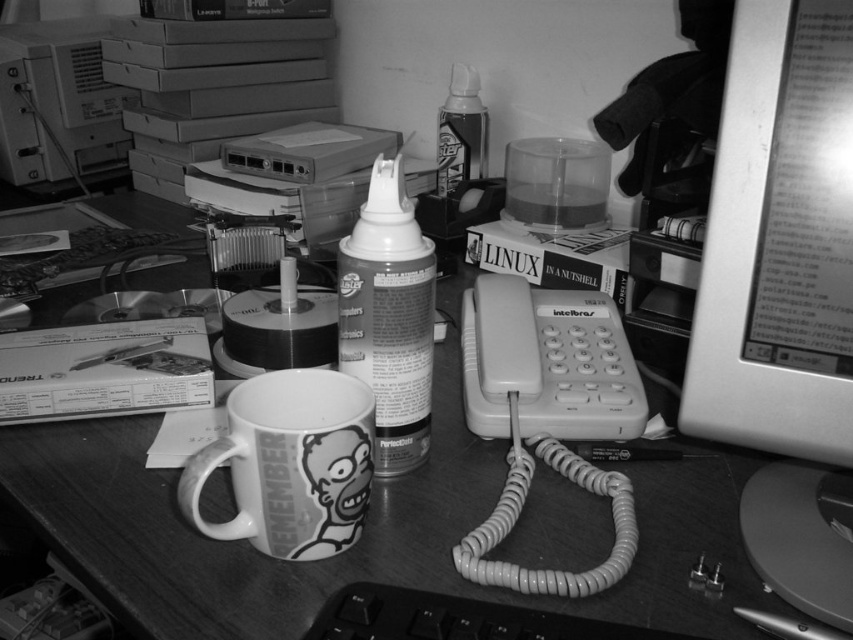
Based on the scene description, where is the metallic silver monitor at right located in the image?

The metallic silver monitor at right is located at point (779,241).

You are setting up a new workspace and need to place a keyboard between the metallic silver monitor at right and the white ceramic mug at center. The keyboard is 12 inches wide. Can the keyboard fit between them?

The distance between the metallic silver monitor at right and the white ceramic mug at center is 10.61 inches. Since the keyboard is 12 inches wide, it cannot fit within that space.